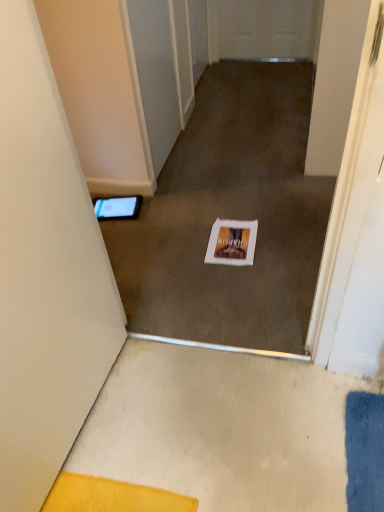
At what (x,y) coordinates should I click in order to perform the action: click on vacant area that lies in front of black glossy tablet at left. Please return your answer as a coordinate pair (x, y). Looking at the image, I should click on (122, 234).